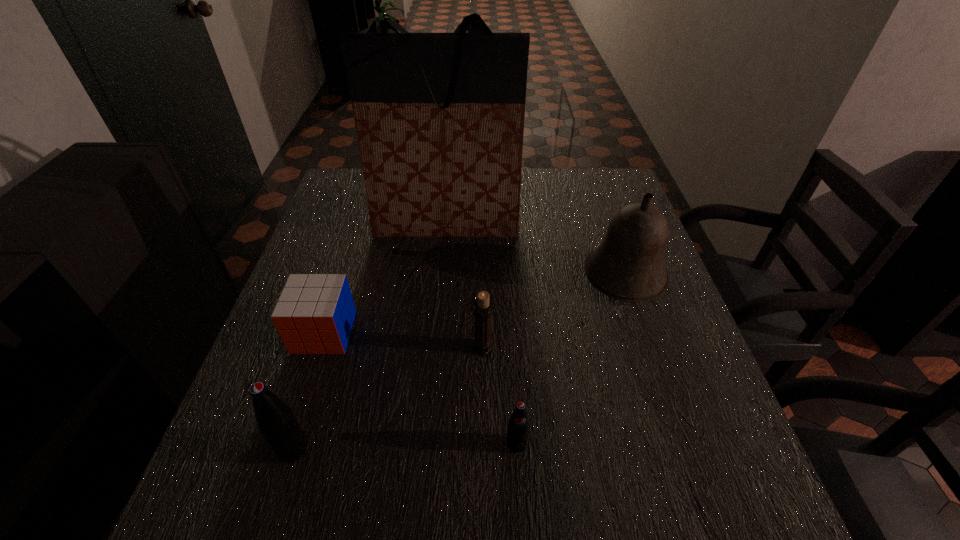
Locate an element on the screen. The image size is (960, 540). the taller pop is located at coordinates (275, 419).

Locate an element on the screen. This screenshot has height=540, width=960. the shorter pop is located at coordinates (518, 426).

Identify the location of the tallest object. Image resolution: width=960 pixels, height=540 pixels. (439, 117).

The width and height of the screenshot is (960, 540). What are the coordinates of `the farthest object` in the screenshot? It's located at (439, 117).

Find the location of a particular element. The width and height of the screenshot is (960, 540). the second farthest object is located at coordinates (628, 265).

Locate an element on the screen. This screenshot has height=540, width=960. bell is located at coordinates (628, 265).

Where is `candle holder`? candle holder is located at coordinates (483, 311).

The width and height of the screenshot is (960, 540). I want to click on cube, so click(315, 313).

This screenshot has width=960, height=540. What are the coordinates of `vacant space located on the front label of the taller pop` in the screenshot? It's located at (244, 448).

Where is `free location located 0.100m on the front label of the taller pop`? The width and height of the screenshot is (960, 540). free location located 0.100m on the front label of the taller pop is located at coordinates (222, 448).